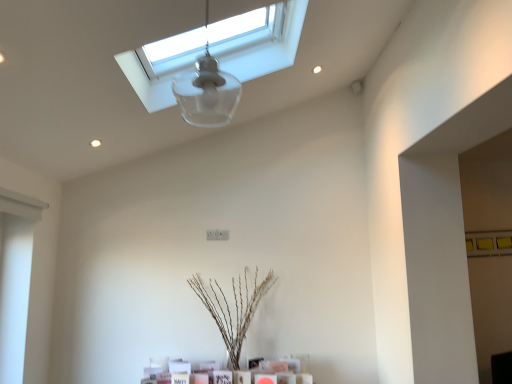
Question: Does transparent glass window at upper center lie behind brown textured plant at center?

Choices:
 (A) yes
 (B) no

Answer: (B)

Question: Is transparent glass window at upper center far from brown textured plant at center?

Choices:
 (A) yes
 (B) no

Answer: (A)

Question: Is transparent glass window at upper center bigger than brown textured plant at center?

Choices:
 (A) yes
 (B) no

Answer: (A)

Question: Can we say transparent glass window at upper center lies outside brown textured plant at center?

Choices:
 (A) no
 (B) yes

Answer: (B)

Question: Is the depth of transparent glass window at upper center less than that of brown textured plant at center?

Choices:
 (A) yes
 (B) no

Answer: (A)

Question: Is brown textured plant at center located within transparent glass window at upper center?

Choices:
 (A) yes
 (B) no

Answer: (B)

Question: Does transparent glass lampshade at upper center touch transparent glass window at upper center?

Choices:
 (A) no
 (B) yes

Answer: (A)

Question: Would you say transparent glass lampshade at upper center is a long distance from transparent glass window at upper center?

Choices:
 (A) no
 (B) yes

Answer: (A)

Question: Is transparent glass lampshade at upper center in front of transparent glass window at upper center?

Choices:
 (A) no
 (B) yes

Answer: (B)

Question: From a real-world perspective, is transparent glass lampshade at upper center located beneath transparent glass window at upper center?

Choices:
 (A) no
 (B) yes

Answer: (B)

Question: Is transparent glass lampshade at upper center at the right side of transparent glass window at upper center?

Choices:
 (A) no
 (B) yes

Answer: (B)

Question: Is transparent glass lampshade at upper center positioned with its back to transparent glass window at upper center?

Choices:
 (A) no
 (B) yes

Answer: (A)

Question: From the image's perspective, is transparent glass lampshade at upper center located beneath brown textured plant at center?

Choices:
 (A) yes
 (B) no

Answer: (B)